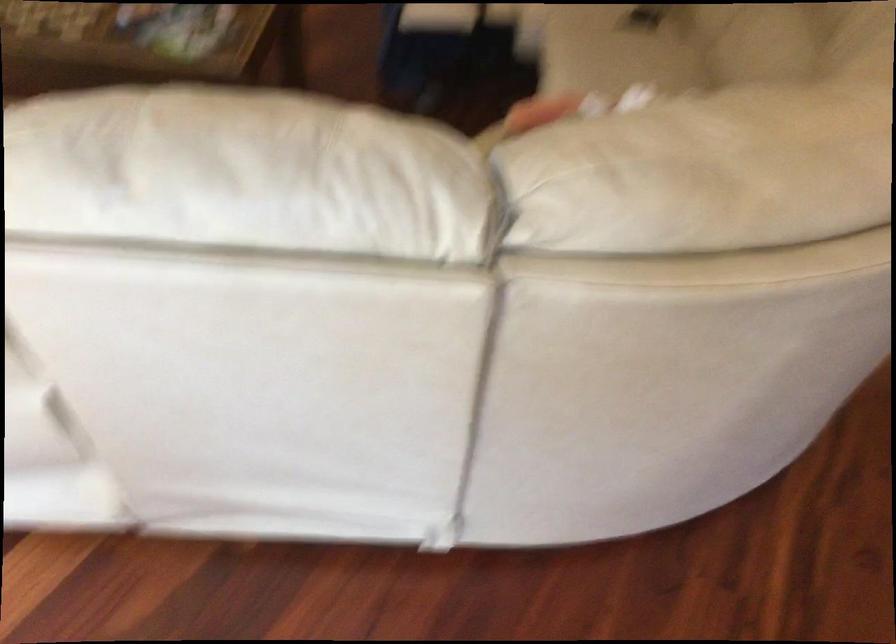
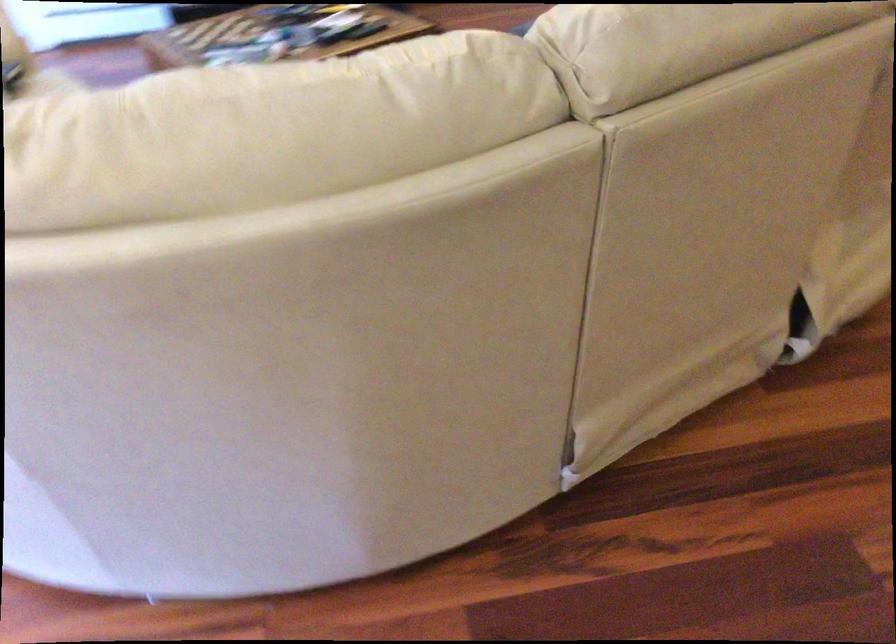
Question: I am providing you with two images of the same scene from different viewpoints. Which of the following objects are not visible in image2?

Choices:
 (A) package of toilet paper
 (B) sofa sitting surface
 (C) white sofa sitting surface
 (D) sofa armrest

Answer: (C)